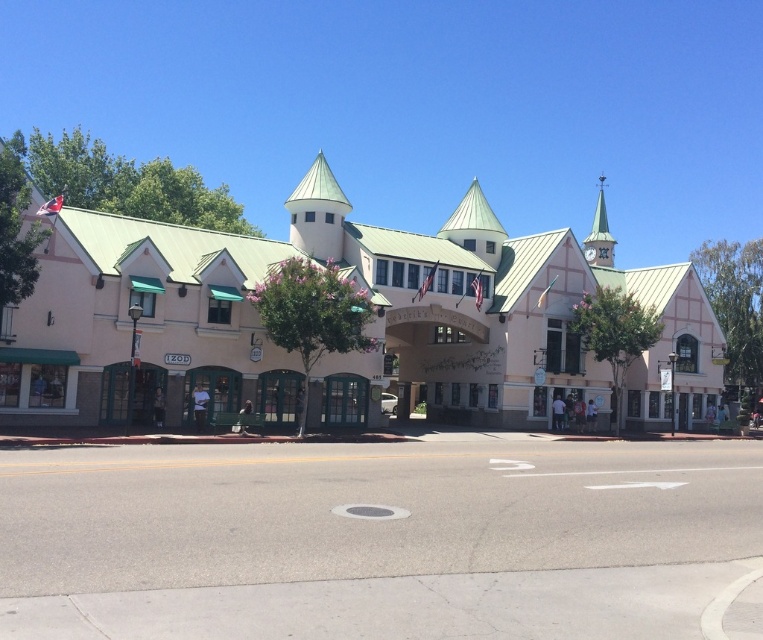
You are standing in front of the pink matte building at center and want to take a photo of the metallic spire at upper right. Since the building is in the way, can you still see the spire from your current position?

The pink matte building at center is located below the metallic spire at upper right, so yes, you can still see the metallic spire at upper right from your current position because it is above the building.

You are an architect reviewing the design of the pink matte building at center and the metallic spire at upper right. Based on the provided image, which structure appears smaller in size?

The pink matte building at center appears smaller in size compared to the metallic spire at upper right according to the description.

You are standing in front of the building and want to take a photo of both the pink matte building at center and the metallic spire at upper right. Which object should you focus on first to ensure both are in clear view?

You should focus on the pink matte building at center first since it is closer to the viewer than the metallic spire at upper right, ensuring both are in clear view by adjusting the focus accordingly.